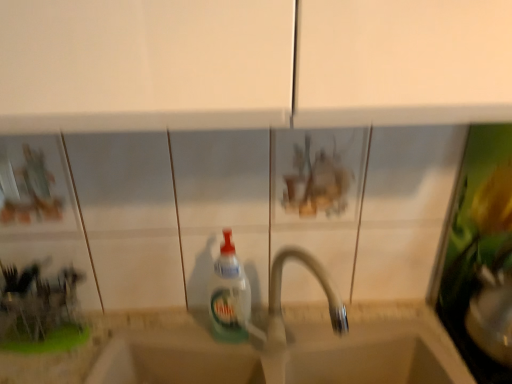
Question: From a real-world perspective, is translucent plastic bottle at center above or below beige stone sink at center?

Choices:
 (A) below
 (B) above

Answer: (B)

Question: Is translucent plastic bottle at center in front of or behind beige stone sink at center in the image?

Choices:
 (A) front
 (B) behind

Answer: (A)

Question: Which object is the farthest from the white plastic tap at center?

Choices:
 (A) beige stone sink at center
 (B) translucent plastic bottle at center

Answer: (A)

Question: Considering the real-world distances, which object is farthest from the beige stone sink at center?

Choices:
 (A) white plastic tap at center
 (B) translucent plastic bottle at center

Answer: (B)